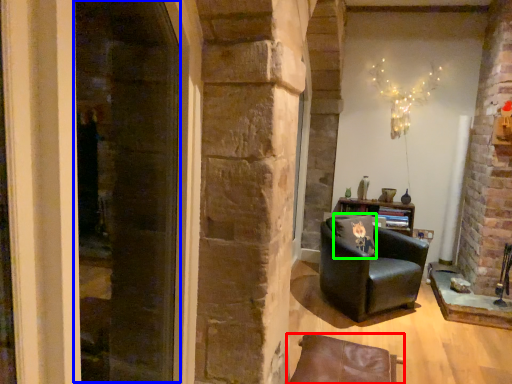
Question: Which object is positioned farthest from chair (highlighted by a red box)? Select from screen door (highlighted by a blue box) and pillow (highlighted by a green box).

Choices:
 (A) screen door
 (B) pillow

Answer: (A)